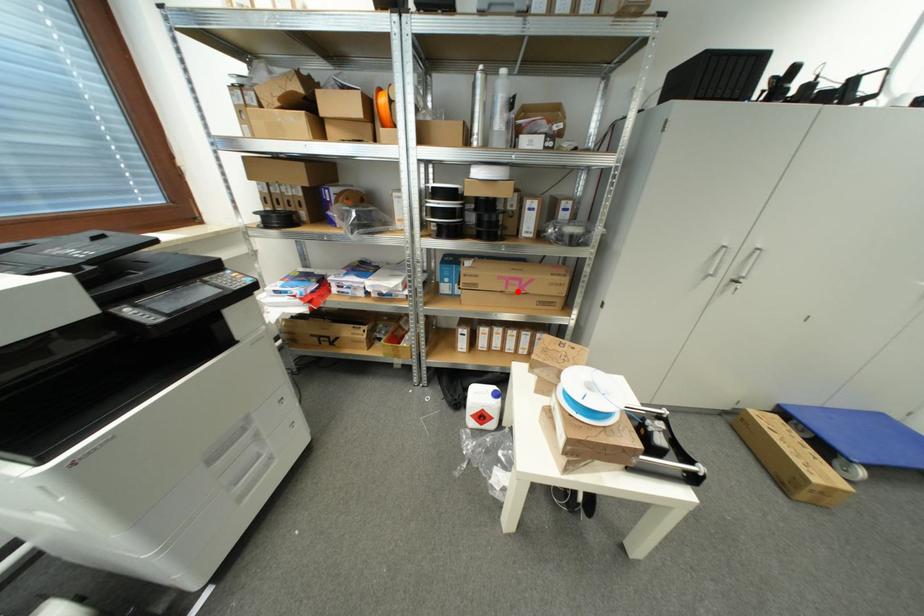
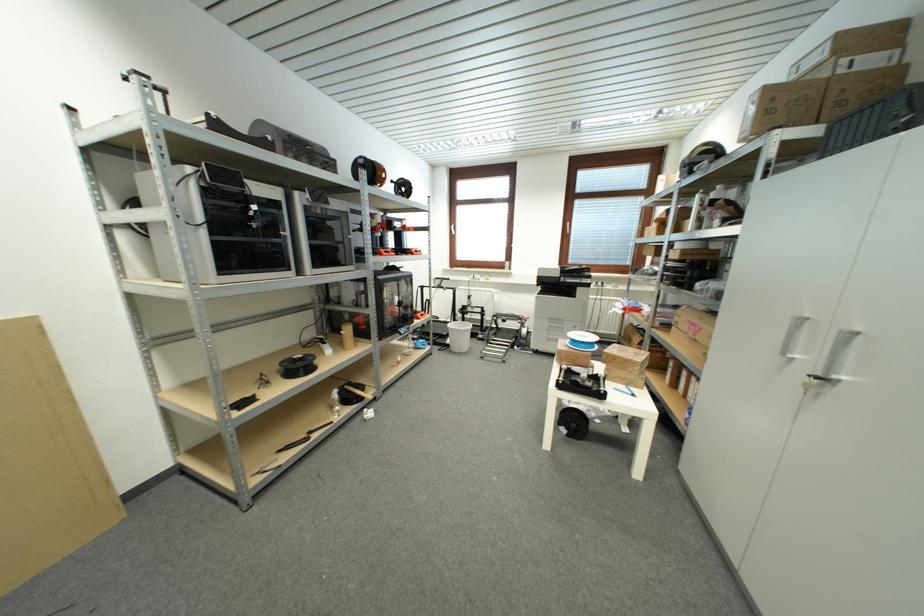
Question: I am providing you with two images of the same scene from different viewpoints. Given a red point in image1, look at the same physical point in image2. Is it:

Choices:
 (A) Closer to the viewpoint
 (B) Farther from the viewpoint

Answer: (A)